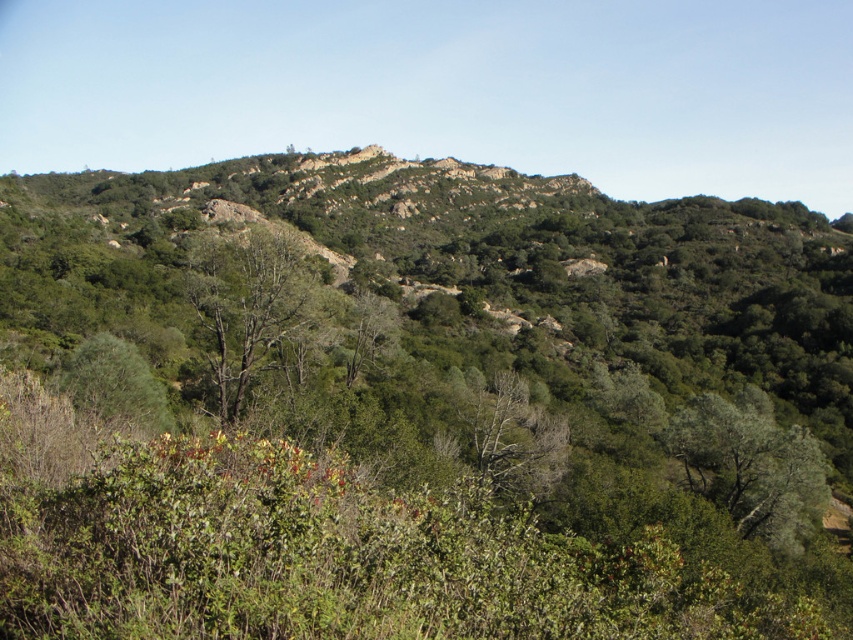
Question: Which object is farther from the camera taking this photo?

Choices:
 (A) green leafy tree at center
 (B) green leafy tree at lower left
 (C) green matte tree at center

Answer: (C)

Question: Which point is closer to the camera taking this photo?

Choices:
 (A) (293, 294)
 (B) (67, 381)

Answer: (A)

Question: From the image, what is the correct spatial relationship of green leafy tree at lower right in relation to green leafy tree at lower left?

Choices:
 (A) right
 (B) left

Answer: (A)

Question: Can you confirm if green matte tree at center is positioned to the right of green leafy tree at center?

Choices:
 (A) no
 (B) yes

Answer: (A)

Question: Is green leafy tree at lower right behind green leafy tree at lower left?

Choices:
 (A) no
 (B) yes

Answer: (B)

Question: Which object is closer to the camera taking this photo?

Choices:
 (A) green leafy tree at lower right
 (B) green leafy tree at lower left
 (C) green matte tree at center
 (D) green leafy tree at center

Answer: (B)